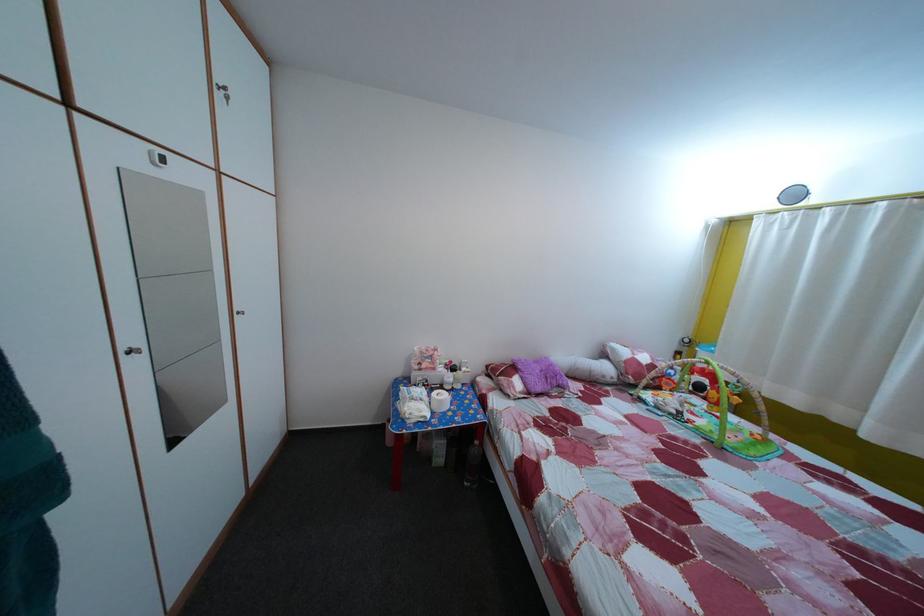
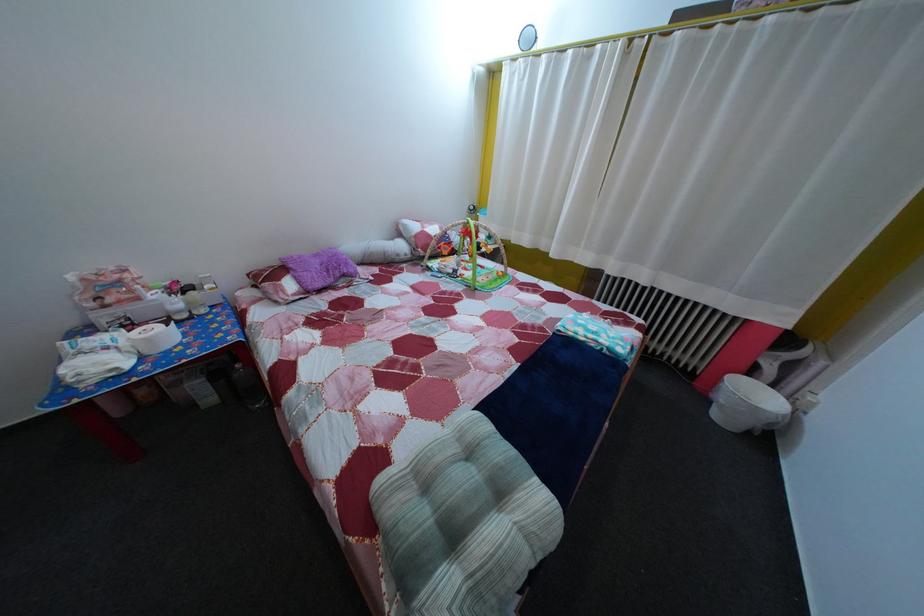
In the second image, find the point that corresponds to pixel 473 377 in the first image.

(216, 294)